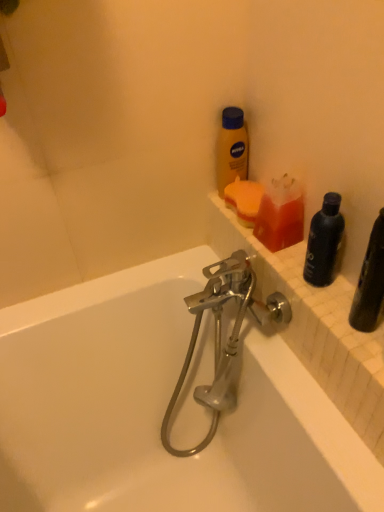
Identify the location of free point in front of translucent orange soap at upper right, the 2th cleaning product viewed from the back. (294, 282).